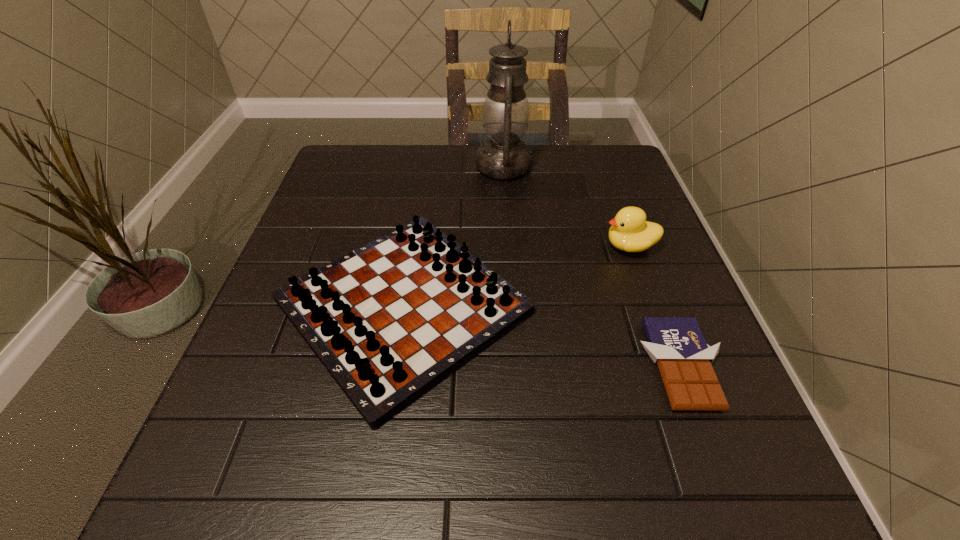
The image size is (960, 540). I want to click on vacant point located between the chessboard and the duckling, so click(x=516, y=276).

The height and width of the screenshot is (540, 960). I want to click on empty space that is in between the chocolate bar and the chessboard, so click(x=542, y=336).

Image resolution: width=960 pixels, height=540 pixels. Identify the location of blank region between the shortest object and the chessboard. (542, 336).

Find the location of `vacant point located between the chocolate bar and the chessboard`. vacant point located between the chocolate bar and the chessboard is located at coordinates (542, 336).

The height and width of the screenshot is (540, 960). In order to click on vacant area between the shortest object and the duckling in this screenshot , I will do `click(656, 306)`.

Identify the location of free space between the duckling and the chessboard. The image size is (960, 540). (516, 276).

You are a GUI agent. You are given a task and a screenshot of the screen. Output one action in this format:
    pyautogui.click(x=<x>, y=<y>)
    Task: Click on the vacant area that lies between the duckling and the shortest object
    The image size is (960, 540).
    Given the screenshot: What is the action you would take?
    tap(656, 306)

Where is `unoccupied area between the duckling and the chessboard`? This screenshot has width=960, height=540. unoccupied area between the duckling and the chessboard is located at coordinates (516, 276).

This screenshot has width=960, height=540. Identify the location of free space between the duckling and the chessboard. (516, 276).

The height and width of the screenshot is (540, 960). What are the coordinates of `the second closest object to the shortest object` in the screenshot? It's located at (630, 231).